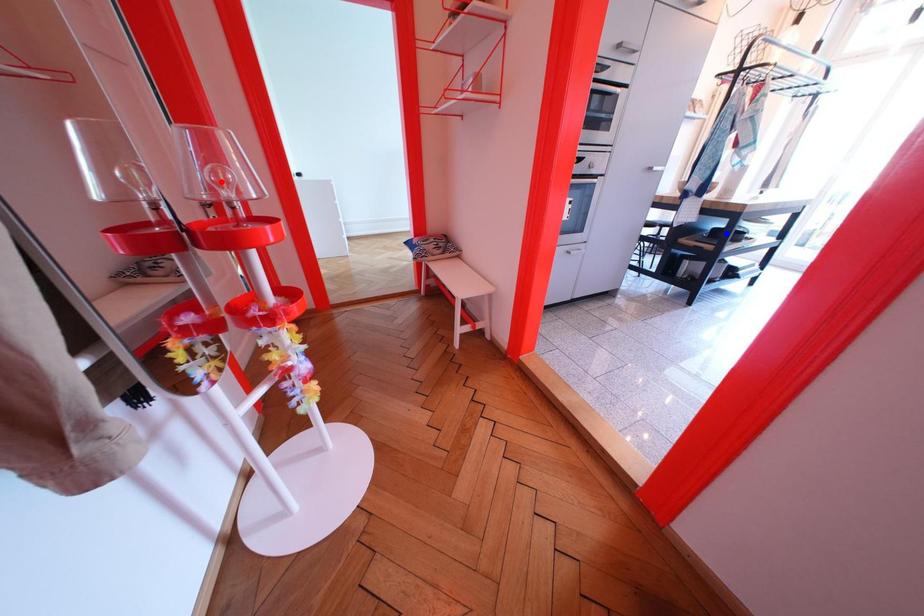
Question: In the image, two points are highlighted. Which point is nearer to the camera? Reply with the corresponding letter.

Choices:
 (A) blue point
 (B) red point

Answer: (B)